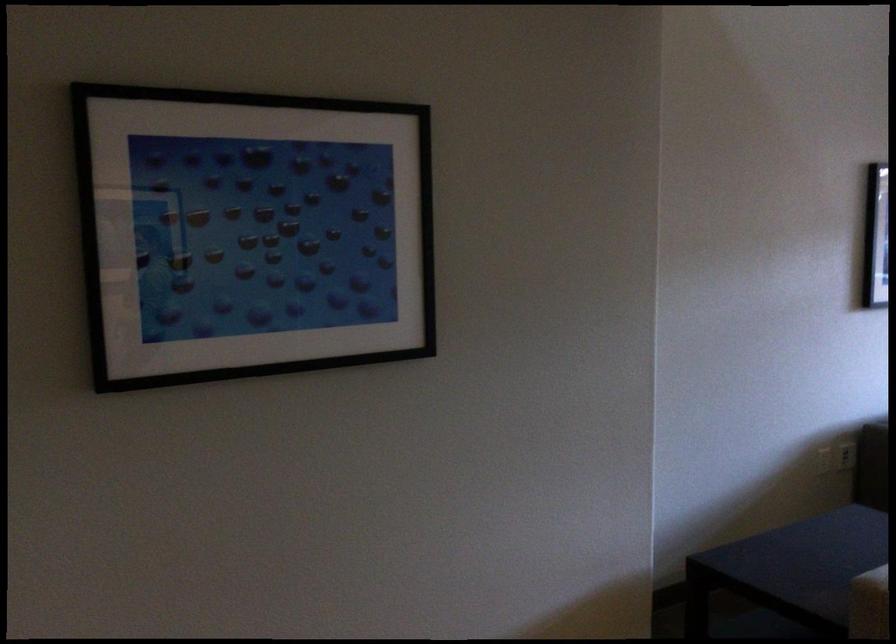
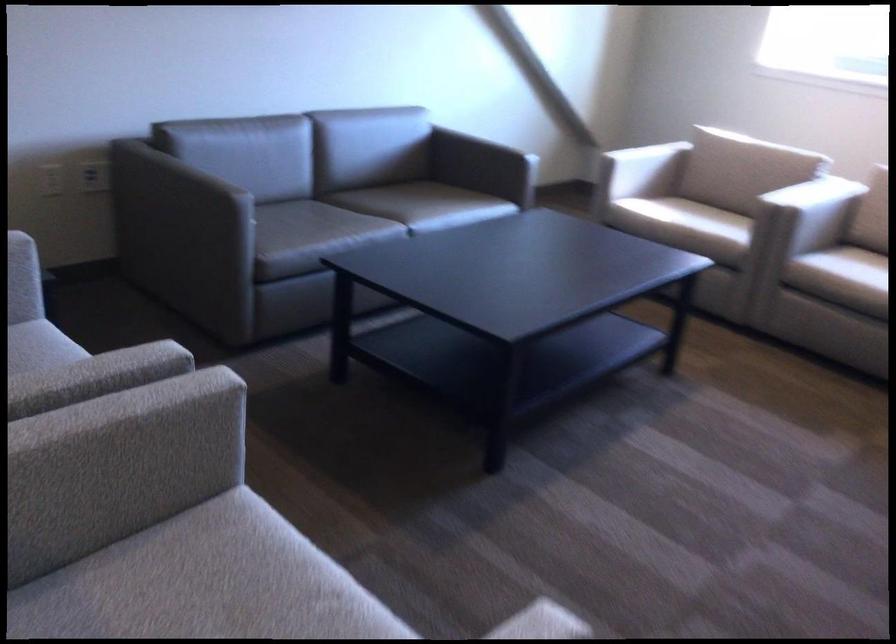
Question: Which direction would the cameraman need to move to produce the second image? Reply with the corresponding letter.

Choices:
 (A) Left
 (B) Right
 (C) Forward
 (D) Backward

Answer: (B)